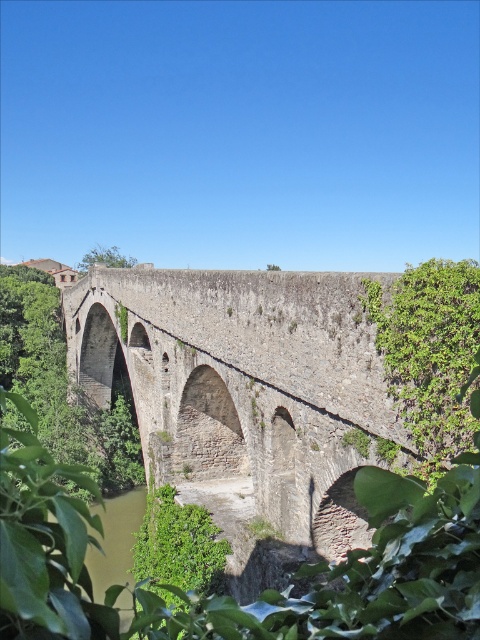
Question: Which point appears closest to the camera in this image?

Choices:
 (A) (266, 637)
 (B) (394, 321)

Answer: (A)

Question: Is green leafy plant at right thinner than green leafy vegetation at lower left?

Choices:
 (A) no
 (B) yes

Answer: (B)

Question: Which of the following is the closest to the observer?

Choices:
 (A) (279, 337)
 (B) (422, 369)
 (C) (149, 513)

Answer: (B)

Question: Does green leafy vegetation at center have a larger size compared to green leafy plant at right?

Choices:
 (A) yes
 (B) no

Answer: (A)

Question: Among these objects, which one is farthest from the camera?

Choices:
 (A) green leafy vegetation at center
 (B) green leafy plant at right
 (C) green leafy vegetation at lower left

Answer: (C)

Question: Is the position of green leafy plant at right less distant than that of green leafy vegetation at lower left?

Choices:
 (A) no
 (B) yes

Answer: (B)